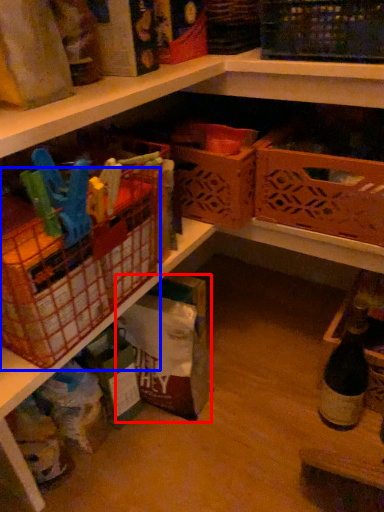
Question: Which object appears farthest to the camera in this image, storage box (highlighted by a red box) or basket (highlighted by a blue box)?

Choices:
 (A) storage box
 (B) basket

Answer: (A)